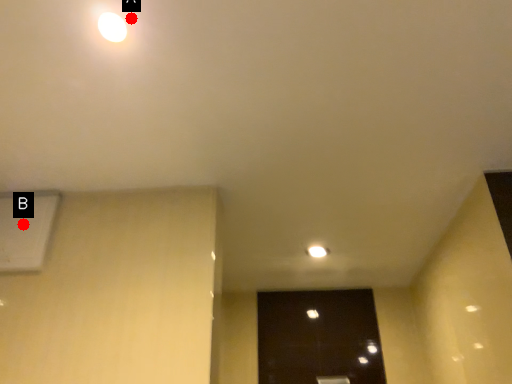
Question: Two points are circled on the image, labeled by A and B beside each circle. Which point is farther from the camera taking this photo?

Choices:
 (A) A is further
 (B) B is further

Answer: (B)